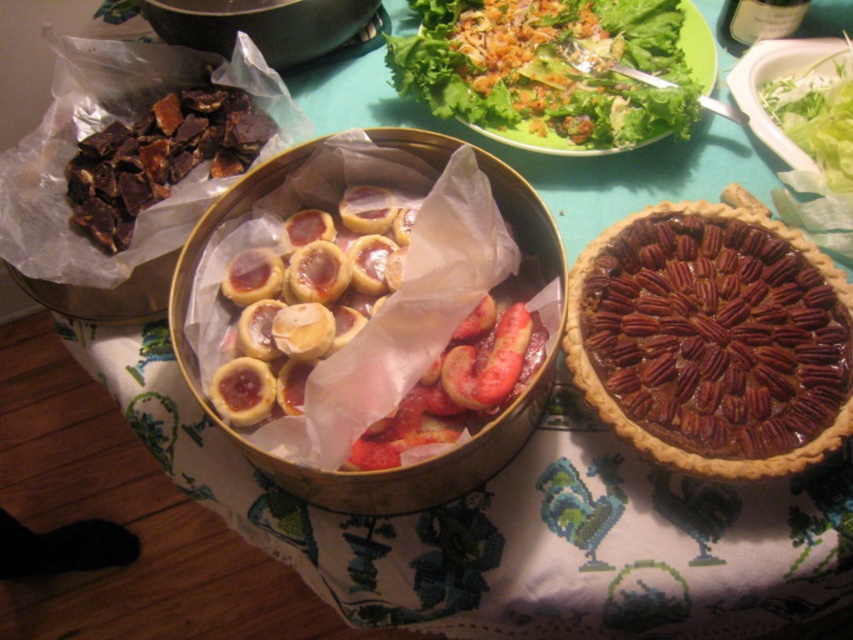
Question: In this image, where is green leafy salad at upper center located relative to shiny brown pie at center?

Choices:
 (A) right
 (B) left

Answer: (A)

Question: Which point is farther to the camera?

Choices:
 (A) green leafy salad at upper center
 (B) shiny brown pie at center

Answer: (A)

Question: Does brown crumbly pie at center right have a lesser width compared to shiny brown pie at center?

Choices:
 (A) yes
 (B) no

Answer: (A)

Question: Which of these objects is positioned farthest from the shiny brown pie at center?

Choices:
 (A) green leafy salad at upper center
 (B) brown crumbly pie at center right

Answer: (A)

Question: Observing the image, what is the correct spatial positioning of brown crumbly pie at center right in reference to shiny brown pie at center?

Choices:
 (A) left
 (B) right

Answer: (B)

Question: Estimate the real-world distances between objects in this image. Which object is farther from the shiny brown pie at center?

Choices:
 (A) green leafy salad at upper center
 (B) brown crumbly pie at center right

Answer: (A)